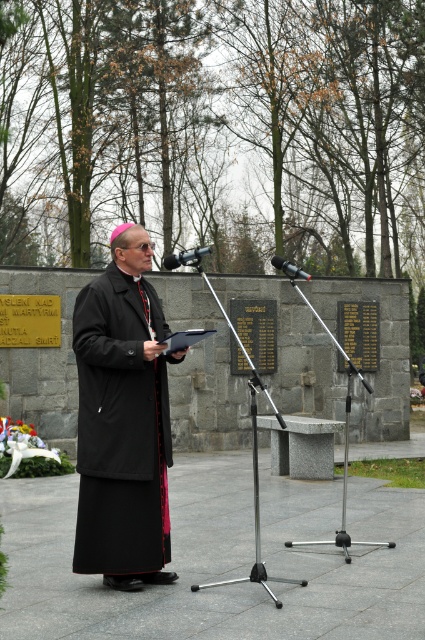
You are a sound technician at the event and need to choose a microphone that is easier to see from the back of the room. Which microphone should you choose between the metallic silver microphone at center and the black metallic microphone at center?

The metallic silver microphone at center has a larger size compared to the black metallic microphone at center, so it would be easier to see from the back of the room.

You are a photographer at the event and need to capture a photo that shows both the black woolen robe at center and the black metallic microphone at center. Based on their positions, which object should be placed to the left in the frame?

The black woolen robe at center is positioned on the left side of the black metallic microphone at center, so in the frame, the black woolen robe at center should be placed to the left.

You are a photographer positioned behind the metallic silver microphone at center. You want to capture a photo where the black woolen robe at center is clearly visible in the foreground. Since the robe is taller than the microphone, will the robe block the view of the microphone in your photo?

The black woolen robe at center is taller than the metallic silver microphone at center, so it may block the microphone from view depending on the camera angle and distance. To ensure both are visible, adjust your position or angle so the robe is partially visible without obscuring the microphone.